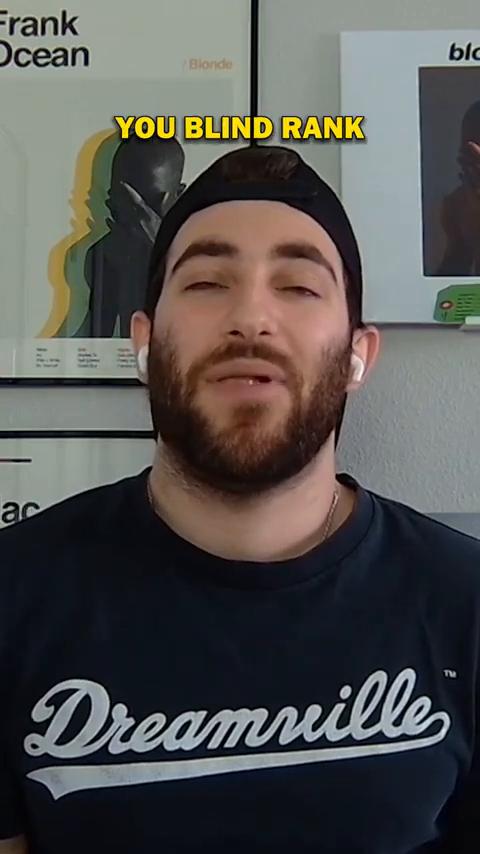
Find the location of `artwork`. artwork is located at coordinates (441, 168), (101, 177), (27, 482).